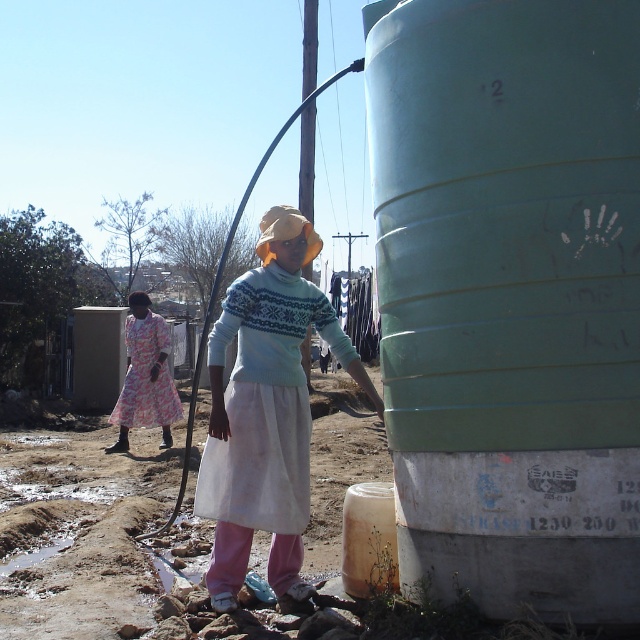
You are a fashion designer observing the outdoor scene. You notice two outfits in the image. Which outfit is taller when comparing the light blue sweater at center and the floral cotton dress at left?

The light blue sweater at center is taller than the floral cotton dress at left.

You are a delivery person who needs to place a heavy package on the ground. You see the light blue plastic barrel at center and the floral cotton dress at left in the scene. Which object is higher up and can you place the package on top of it?

The light blue plastic barrel at center is located above the floral cotton dress at left, so you can place the package on top of the light blue plastic barrel at center.